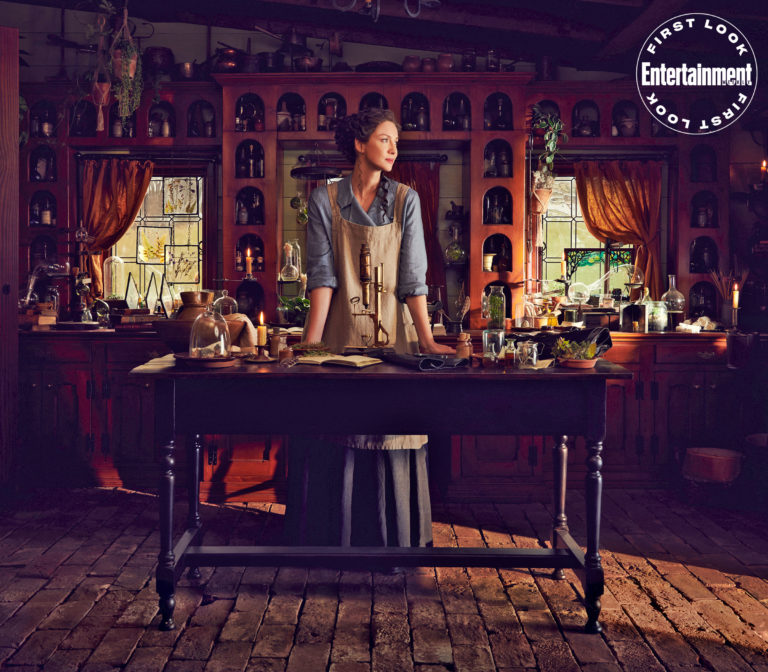
Identify the location of ground beneath table. The width and height of the screenshot is (768, 672). (369, 621).